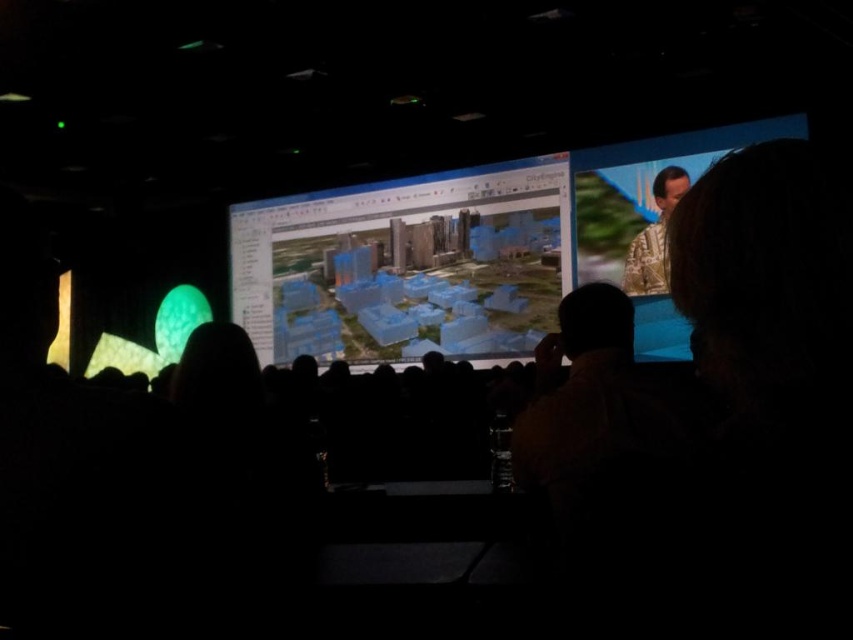
Can you confirm if transparent blue model at center is bigger than patterned fabric shirt at upper right?

Yes, transparent blue model at center is bigger than patterned fabric shirt at upper right.

Describe the element at coordinates (405, 266) in the screenshot. The width and height of the screenshot is (853, 640). I see `transparent blue model at center` at that location.

Does point (340, 253) lie behind point (635, 236)?

Yes, it is behind point (635, 236).

This screenshot has height=640, width=853. What are the coordinates of `transparent blue model at center` in the screenshot? It's located at (405, 266).

Between transparent blue model at center and camouflage fabric speaker at upper right, which one has less height?

With less height is camouflage fabric speaker at upper right.

I want to click on transparent blue model at center, so pyautogui.click(x=405, y=266).

At what (x,y) coordinates should I click in order to perform the action: click on transparent blue model at center. Please return your answer as a coordinate pair (x, y). Looking at the image, I should click on (405, 266).

Can you confirm if camouflage fabric speaker at upper right is shorter than patterned fabric shirt at upper right?

No, camouflage fabric speaker at upper right is not shorter than patterned fabric shirt at upper right.

Between point (654, 284) and point (630, 268), which one is positioned behind?

The point (630, 268) is behind.

Which is in front, point (575, 198) or point (636, 282)?

Point (636, 282)

Locate an element on the screen. The width and height of the screenshot is (853, 640). camouflage fabric speaker at upper right is located at coordinates (648, 218).